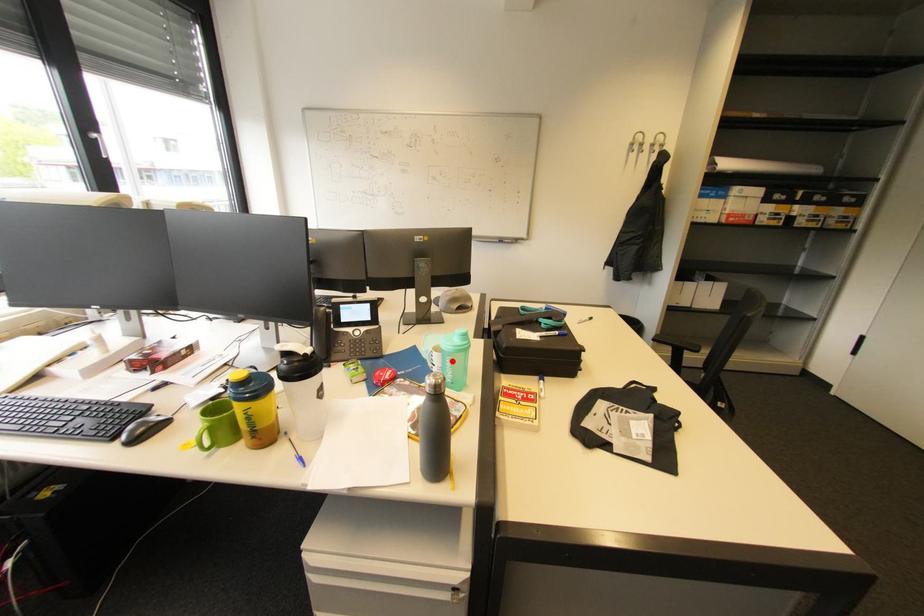
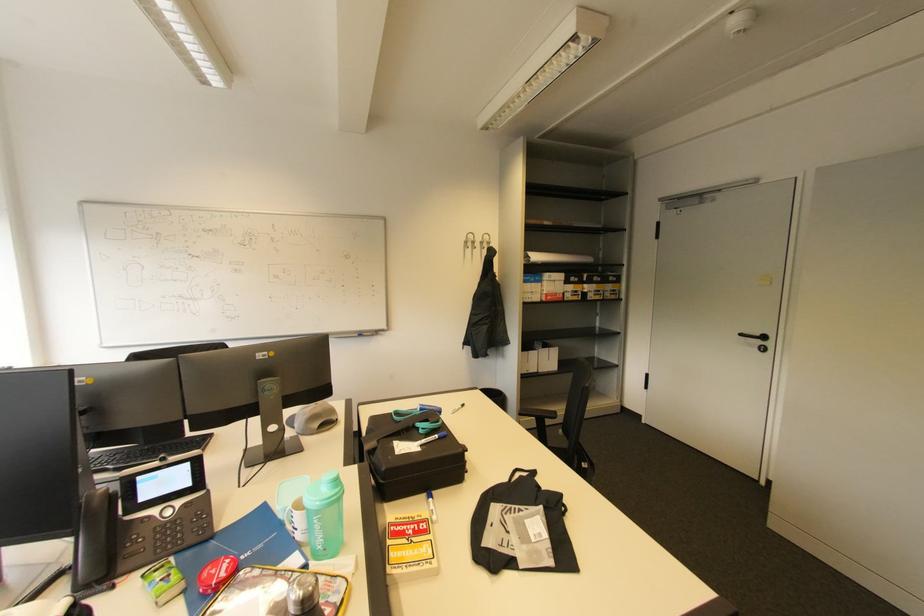
The point at the highlighted location is marked in the first image. Where is the corresponding point in the second image?

(320, 522)